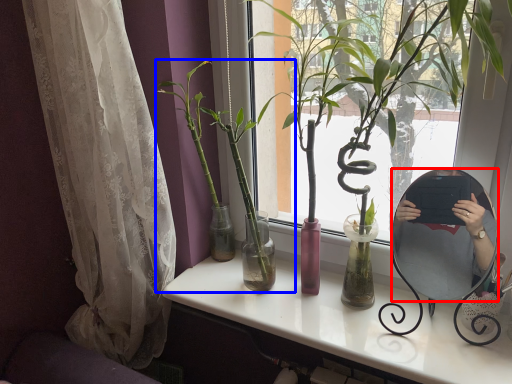
Question: Among these objects, which one is farthest to the camera, mirror (highlighted by a red box) or houseplant (highlighted by a blue box)?

Choices:
 (A) mirror
 (B) houseplant

Answer: (B)